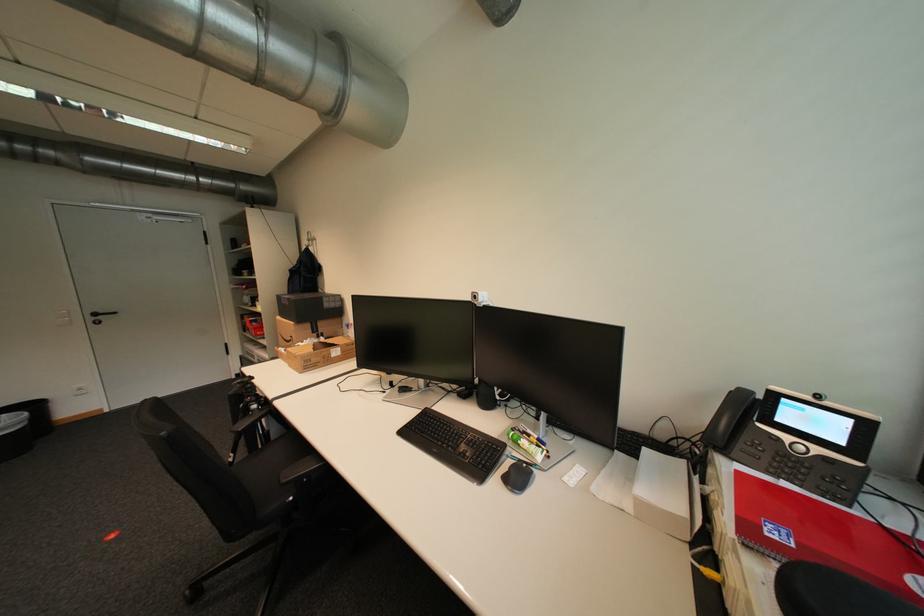
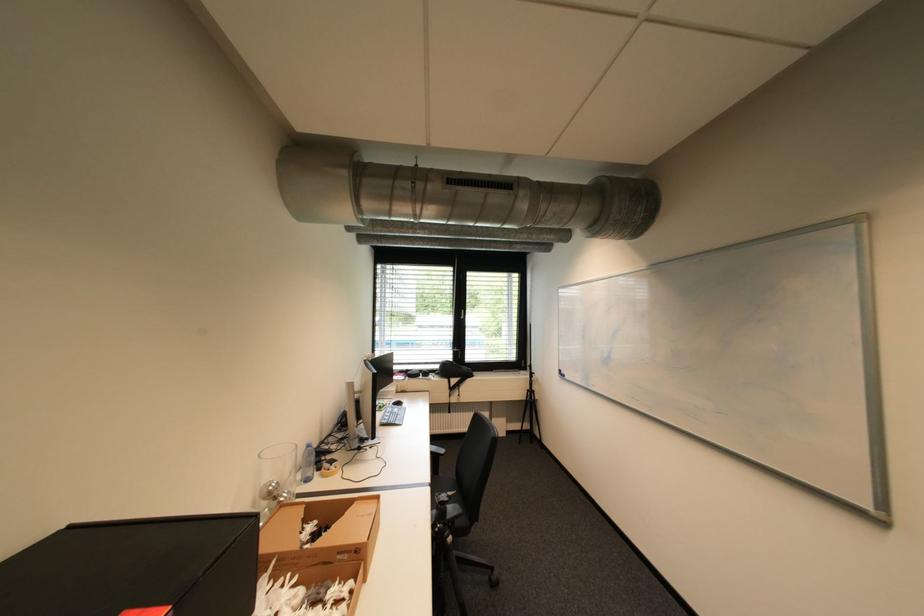
Question: I am providing you with two images of the same scene from different viewpoints. Which of the following objects are not visible in image2?

Choices:
 (A) chair sitting surface
 (B) phone button
 (C) bottle cap
 (D) white power adapter

Answer: (B)